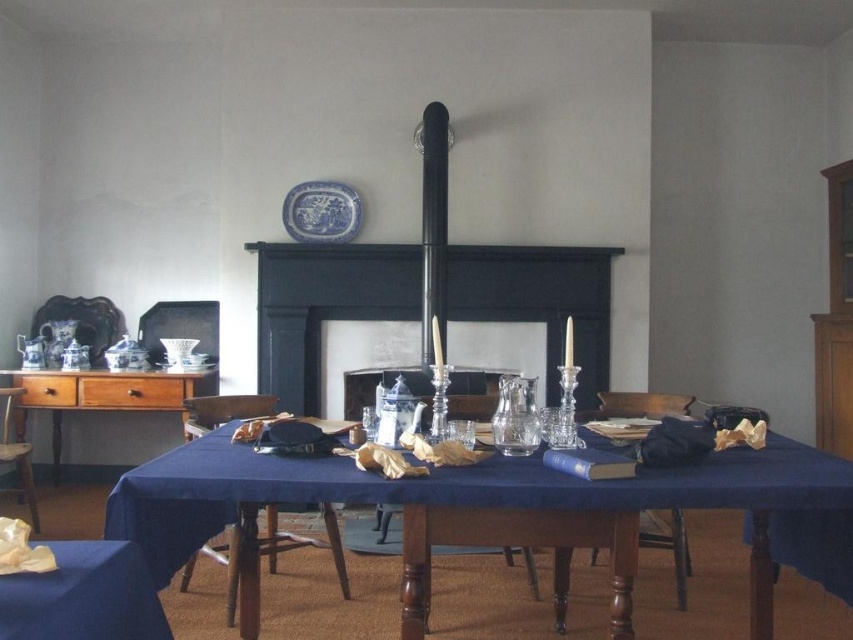
You are an interior designer assessing the layout of this room. You notice two wooden chairs. Which chair is positioned lower in the room, the wooden chair at center or the wooden chair at left?

The wooden chair at center is positioned lower in the room because it is below the wooden chair at left.

Consider the image. You are a guest in this historical room and need to choose between the wooden chair at center and the wooden chair at left. Which chair offers more seating space?

The wooden chair at center offers more seating space since it has a larger size compared to the wooden chair at left.

You are an interior designer planning to place a new decorative item in the room. You have a choice between placing it on the black matte fireplace at center or the blue porcelain plate at upper center. Based on their sizes, which surface would be more suitable for a larger decorative item?

The black matte fireplace at center is larger in size than the blue porcelain plate at upper center, so it would be more suitable for placing a larger decorative item.